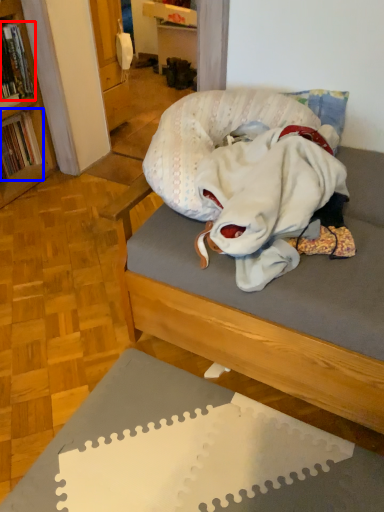
Question: Which object appears farthest to the camera in this image, book (highlighted by a red box) or book (highlighted by a blue box)?

Choices:
 (A) book
 (B) book

Answer: (B)